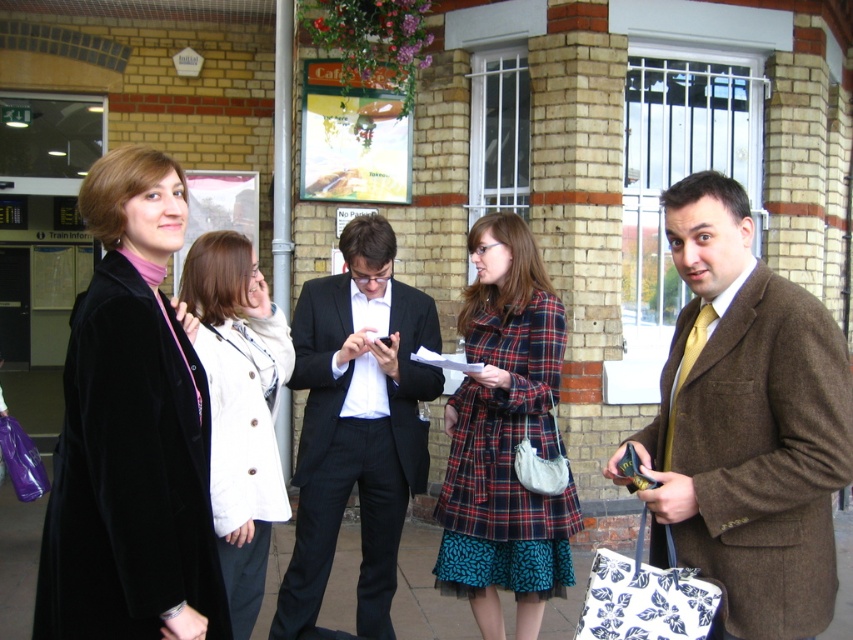
Question: Which point appears farthest from the camera in this image?

Choices:
 (A) (498, 371)
 (B) (641, 566)
 (C) (503, 541)

Answer: (C)

Question: Which point is closer to the camera?

Choices:
 (A) smooth concrete pavement at center
 (B) velvet black coat at left

Answer: (B)

Question: Observing the image, what is the correct spatial positioning of brown woolen coat at center in reference to velvet black coat at left?

Choices:
 (A) below
 (B) above

Answer: (A)

Question: Is white fabric bag at lower right to the left of teal patterned skirt at center from the viewer's perspective?

Choices:
 (A) yes
 (B) no

Answer: (B)

Question: Can you confirm if brown woolen coat at center is smaller than black wool suit at center?

Choices:
 (A) yes
 (B) no

Answer: (A)

Question: Which of the following is the farthest from the observer?

Choices:
 (A) teal patterned skirt at center
 (B) black wool suit at center

Answer: (B)